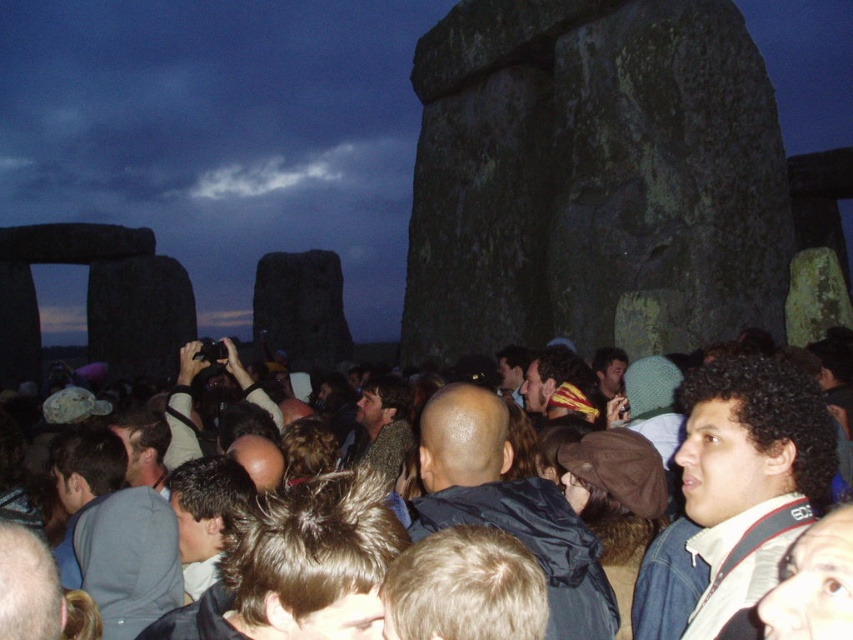
Question: Which point appears farthest from the camera in this image?

Choices:
 (A) (519, 282)
 (B) (181, 394)

Answer: (A)

Question: Does dark gray stone at center appear on the right side of brown fabric crowd at center?

Choices:
 (A) no
 (B) yes

Answer: (B)

Question: Can you confirm if dark gray stone at center is smaller than brown fabric crowd at center?

Choices:
 (A) no
 (B) yes

Answer: (B)

Question: Which point is closer to the camera?

Choices:
 (A) (734, 502)
 (B) (605, 54)

Answer: (A)

Question: In this image, where is dark gray stone at center located relative to brown fabric crowd at center?

Choices:
 (A) left
 (B) right

Answer: (B)